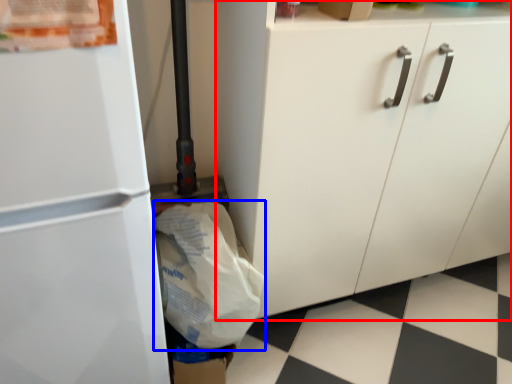
Question: Among these objects, which one is nearest to the camera, cabinetry (highlighted by a red box) or grocery bag (highlighted by a blue box)?

Choices:
 (A) cabinetry
 (B) grocery bag

Answer: (A)